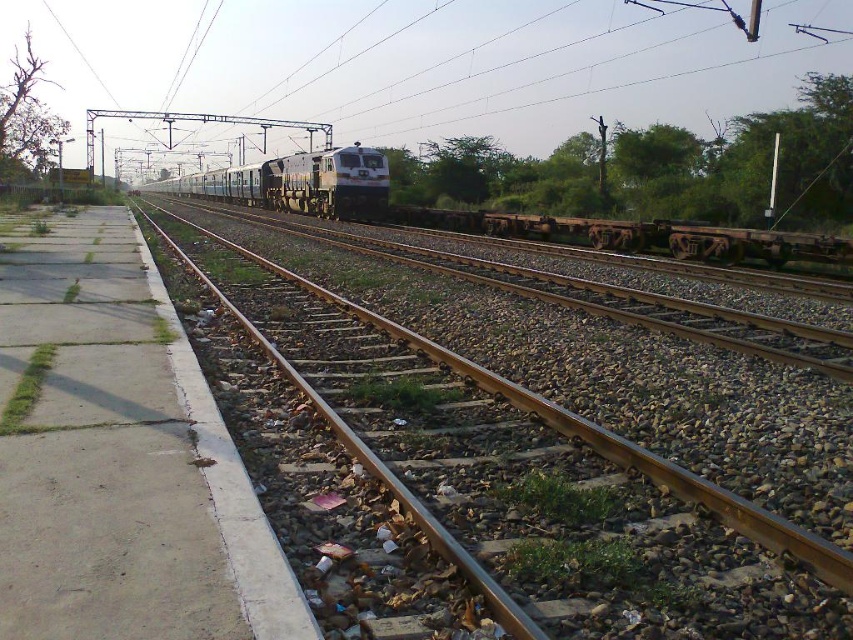
Based on the photo, you are a maintenance worker inspecting the railway tracks. You notice the brown gravel track at center and the metallic wire at upper center. Which object is located lower in the scene?

The brown gravel track at center is positioned under the metallic wire at upper center, so it is located lower in the scene.

You are a maintenance worker on the platform. You need to move the rusty metal flatbed at center to the left side of the metallic blue train at center. Is there enough space between the two tracks to move it safely?

The rusty metal flatbed at center is currently positioned on the right side of the metallic blue train at center. To move it to the left side, you need to ensure there is sufficient space between the two parallel tracks. However, the scene description mentions that the tracks are bordered by gravel with patches of grass and debris, and scattered litter. This suggests that the area between the tracks may be uneven and obstructed, potentially limiting safe movement. Therefore, it is advisable to first clear a